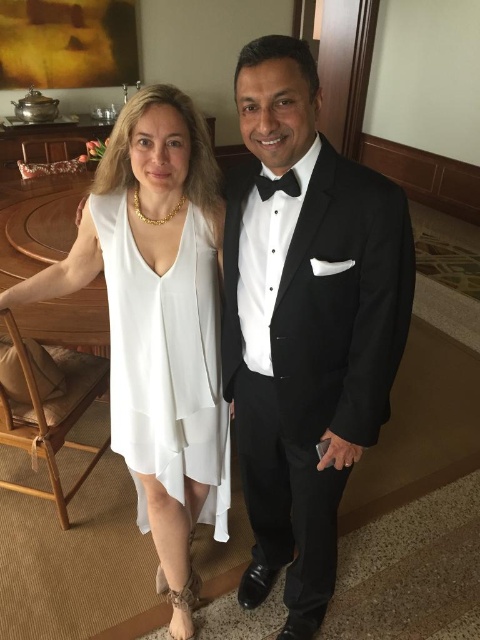
You are a photographer setting up for a formal event. You need to position a light source so that it illuminates both the white sheer dress at center and the black satin bow tie at center without casting harsh shadows. Based on their positions, where should you place the light source relative to the subjects?

The white sheer dress at center is below the black satin bow tie at center. To avoid harsh shadows, place the light source above and centered between the two subjects so it can evenly illuminate both the dress and the bow tie.

You are a photographer setting up for a formal event. You need to position two subjects so that one is in front of the other without blocking the background. Given the current setup with the black satin tuxedo at center and the white sheer dress at center, which subject should you move to ensure proper positioning?

The black satin tuxedo at center is currently in front of the white sheer dress at center. To ensure proper positioning without blocking the background, you should move the black satin tuxedo at center slightly backward so that the white sheer dress at center becomes visible in the background.